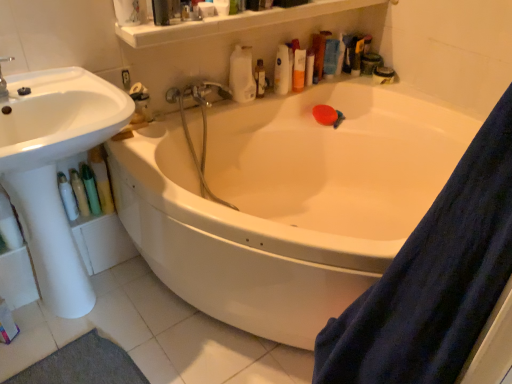
Question: Is translucent plastic bottles at upper center situated inside white glossy bathtub at center or outside?

Choices:
 (A) outside
 (B) inside

Answer: (A)

Question: Considering the positions of translucent plastic bottles at upper center and white glossy bathtub at center in the image, is translucent plastic bottles at upper center wider or thinner than white glossy bathtub at center?

Choices:
 (A) wide
 (B) thin

Answer: (B)

Question: Which object is the farthest from the blue fabric shower curtain at right?

Choices:
 (A) brushed metal faucet at upper left
 (B) translucent plastic bottles at upper center
 (C) translucent plastic bottle at upper right, arranged as the first toiletry when viewed from the top
 (D) metallic chrome faucet at upper center
 (E) white glossy lotion at lower left, the 5th toiletry positioned from the back

Answer: (C)

Question: Estimate the real-world distances between objects in this image. Which object is farther from the brushed metal faucet at upper left?

Choices:
 (A) blue fabric shower curtain at right
 (B) translucent plastic bottle at upper right, arranged as the first toiletry when viewed from the top
 (C) white glossy lotion at lower left, the 1th toiletry in the bottom-to-top sequence
 (D) translucent plastic bottles at upper center
 (E) white glossy sink at left

Answer: (B)